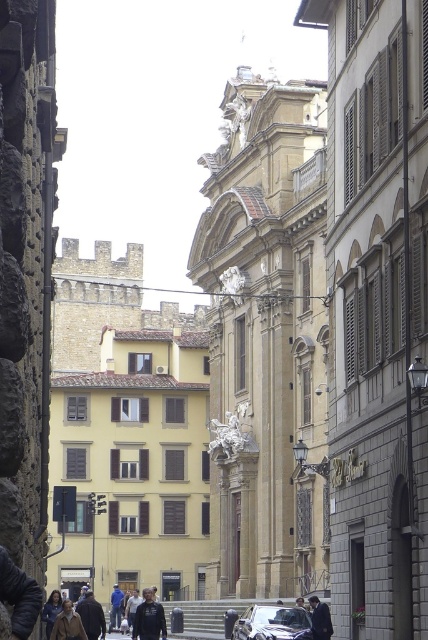
Question: Can you confirm if dark brown leather jacket at lower left is positioned to the right of dark gray suit at center?

Choices:
 (A) no
 (B) yes

Answer: (A)

Question: Is dark gray suit at center below dark blue jeans at lower left?

Choices:
 (A) yes
 (B) no

Answer: (B)

Question: Among these points, which one is farthest from the camera?

Choices:
 (A) (85, 625)
 (B) (155, 632)

Answer: (B)

Question: Which point appears closest to the camera in this image?

Choices:
 (A) (74, 625)
 (B) (112, 612)
 (C) (273, 621)

Answer: (A)

Question: Is dark blue jacket at center above dark brown leather jacket at lower left?

Choices:
 (A) yes
 (B) no

Answer: (B)

Question: Among these points, which one is farthest from the camera?

Choices:
 (A) (98, 620)
 (B) (329, 634)
 (C) (48, 604)

Answer: (A)